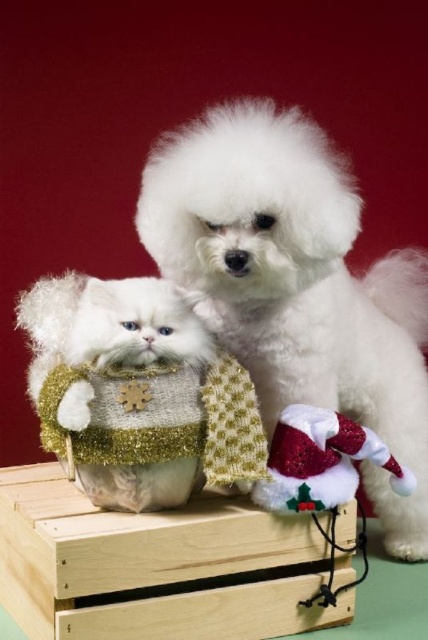
Who is lower down, wooden crate at center or sparkly red santa hat at lower right?

wooden crate at center is below.

Is point (136, 518) positioned after point (294, 483)?

That is False.

Is point (103, 540) farther from viewer compared to point (312, 435)?

No, it is not.

Find the location of a particular element. Image resolution: width=428 pixels, height=640 pixels. wooden crate at center is located at coordinates (149, 564).

Is knitted gold and white sweater at center thinner than wooden crate at center?

Indeed, knitted gold and white sweater at center has a lesser width compared to wooden crate at center.

Who is positioned more to the left, knitted gold and white sweater at center or wooden crate at center?

Answer: Positioned to the left is knitted gold and white sweater at center.

What do you see at coordinates (136, 392) in the screenshot?
I see `knitted gold and white sweater at center` at bounding box center [136, 392].

This screenshot has height=640, width=428. What are the coordinates of `knitted gold and white sweater at center` in the screenshot? It's located at (136, 392).

Is the position of white fluffy dog at upper center less distant than that of wooden crate at center?

No, white fluffy dog at upper center is behind wooden crate at center.

What do you see at coordinates (296, 284) in the screenshot? I see `white fluffy dog at upper center` at bounding box center [296, 284].

I want to click on white fluffy dog at upper center, so click(x=296, y=284).